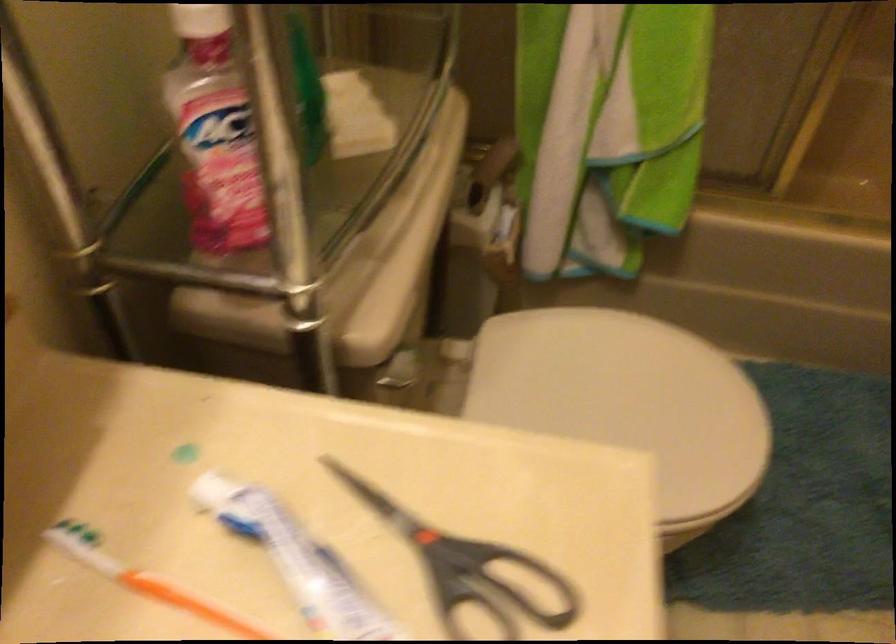
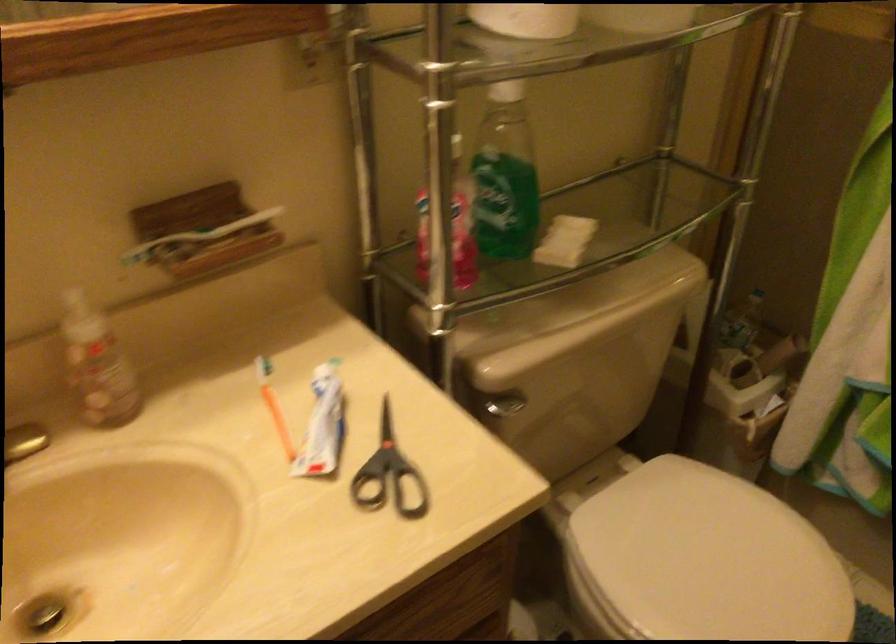
Find the pixel in the second image that matches the point at 614,415 in the first image.

(702, 560)